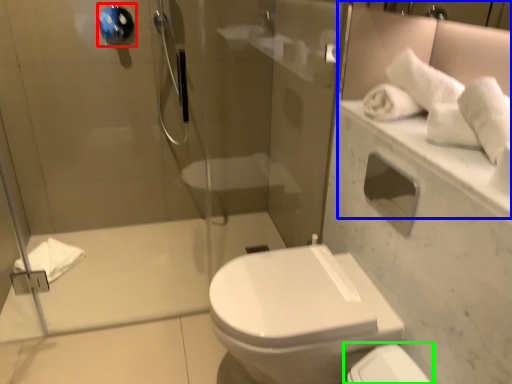
Question: Based on their relative distances, which object is farther from towel bar (highlighted by a red box)? Choose from mirror (highlighted by a blue box) and toilet (highlighted by a green box).

Choices:
 (A) mirror
 (B) toilet

Answer: (B)